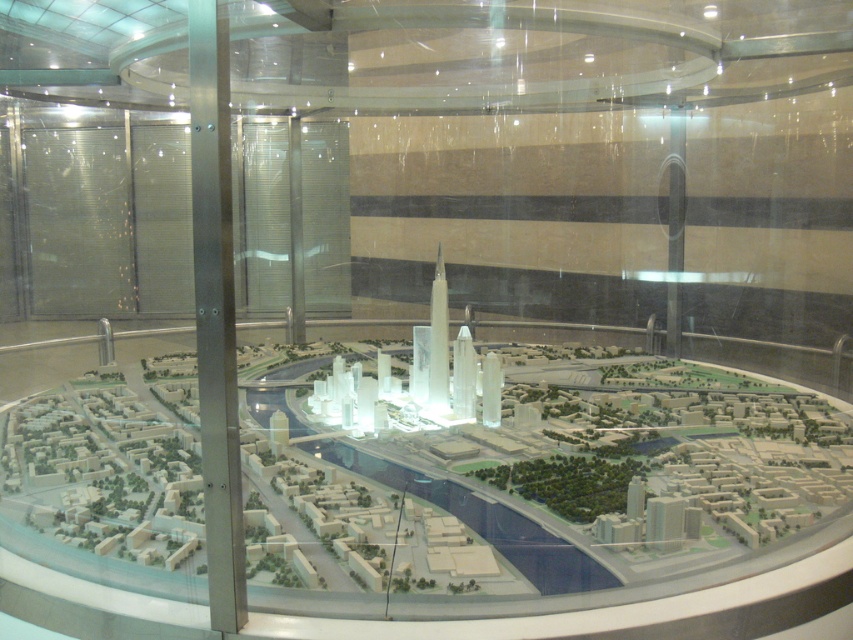
Can you confirm if transparent plastic city model at center is shorter than silver metallic pillar at center?

Yes, transparent plastic city model at center is shorter than silver metallic pillar at center.

Can you confirm if transparent plastic city model at center is positioned below silver metallic pillar at center?

No, transparent plastic city model at center is not below silver metallic pillar at center.

Find the location of a particular element. This screenshot has width=853, height=640. transparent plastic city model at center is located at coordinates (520, 476).